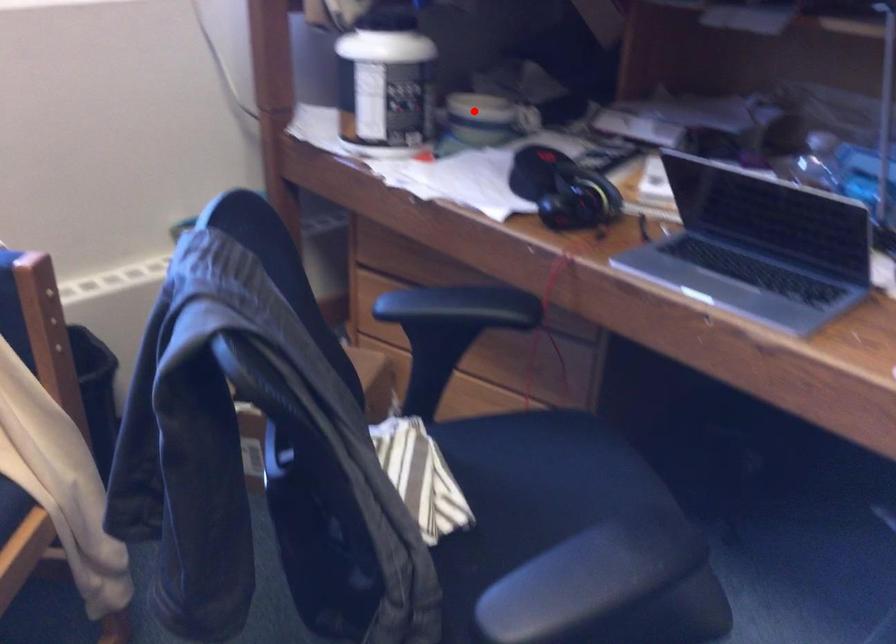
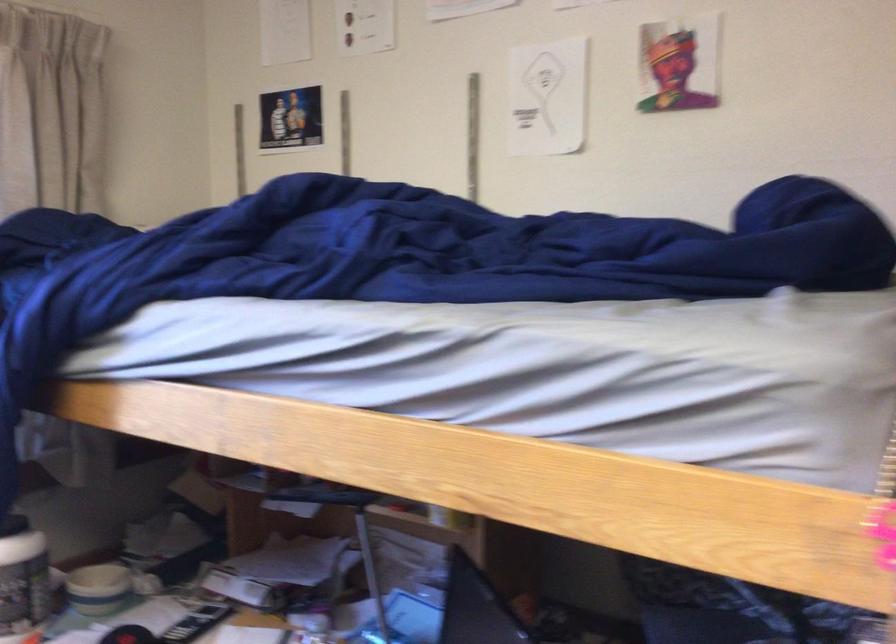
Question: I am providing you with two images of the same scene from different viewpoints. In image1, a red point is highlighted. Considering the same 3D point in image2, which of the following is correct?

Choices:
 (A) It is closer
 (B) It is farther

Answer: (B)